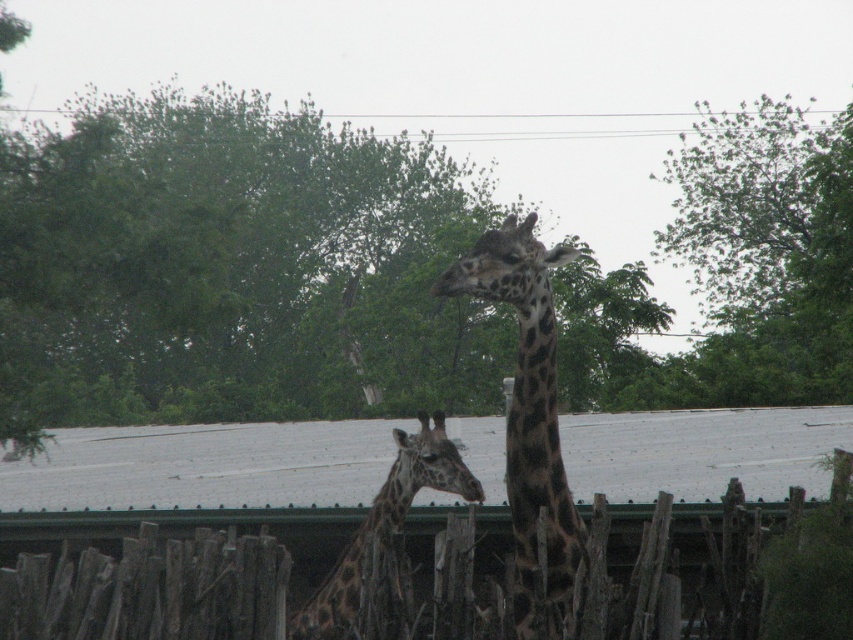
Who is shorter, green leafy tree at upper center or green leafy tree at upper right?

green leafy tree at upper right is shorter.

Is green leafy tree at upper center closer to camera compared to green leafy tree at upper right?

Yes, it is.

What do you see at coordinates (233, 268) in the screenshot?
I see `green leafy tree at upper center` at bounding box center [233, 268].

This screenshot has height=640, width=853. I want to click on green leafy tree at upper center, so click(x=233, y=268).

Measure the distance between point (329, 336) and camera.

Point (329, 336) is 48.87 meters away from camera.

Can you confirm if green leafy tree at upper center is bigger than spotted brown giraffe at center?

Indeed, green leafy tree at upper center has a larger size compared to spotted brown giraffe at center.

Consider the image. Who is more distant from viewer, (468, 163) or (387, 484)?

The point (468, 163) is behind.

The width and height of the screenshot is (853, 640). Find the location of `green leafy tree at upper center`. green leafy tree at upper center is located at coordinates (233, 268).

Is green leafy tree at upper center thinner than wooden fence at center?

In fact, green leafy tree at upper center might be wider than wooden fence at center.

Identify the location of green leafy tree at upper center. This screenshot has height=640, width=853. (233, 268).